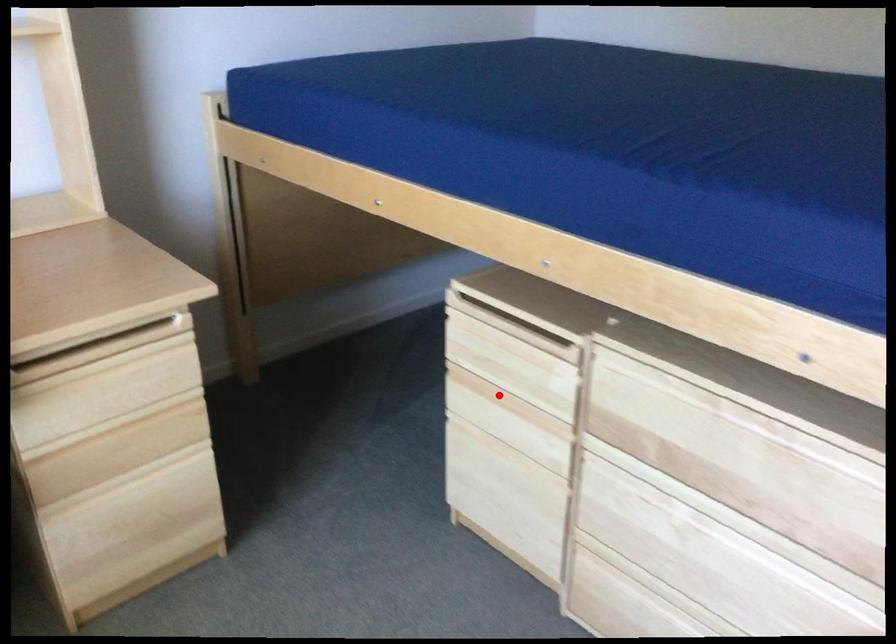
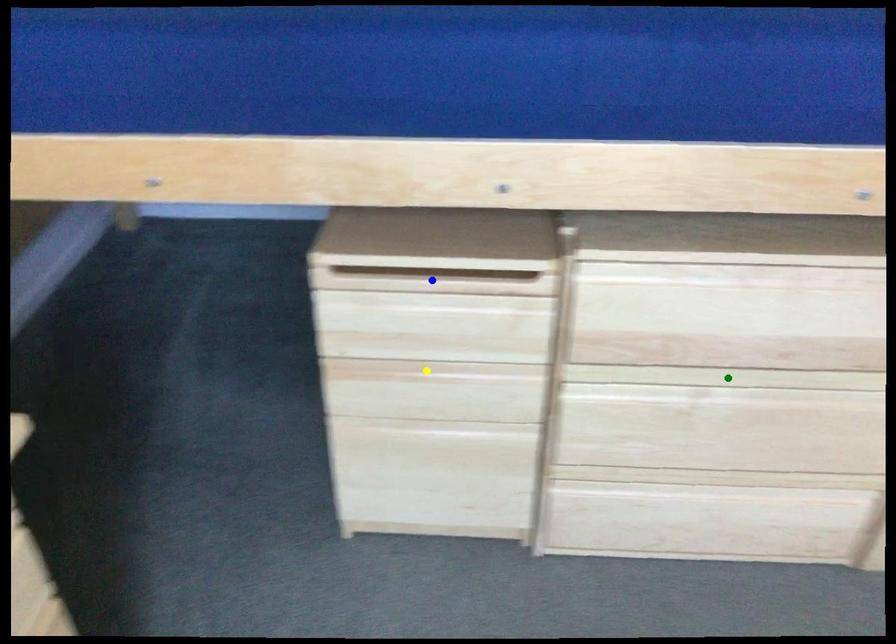
Question: I am providing you with two images of the same scene from different viewpoints. A red point is marked on the first image. You are given multiple points on the second image. Which spot in image 2 lines up with the point in image 1?

Choices:
 (A) yellow point
 (B) blue point
 (C) green point

Answer: (A)